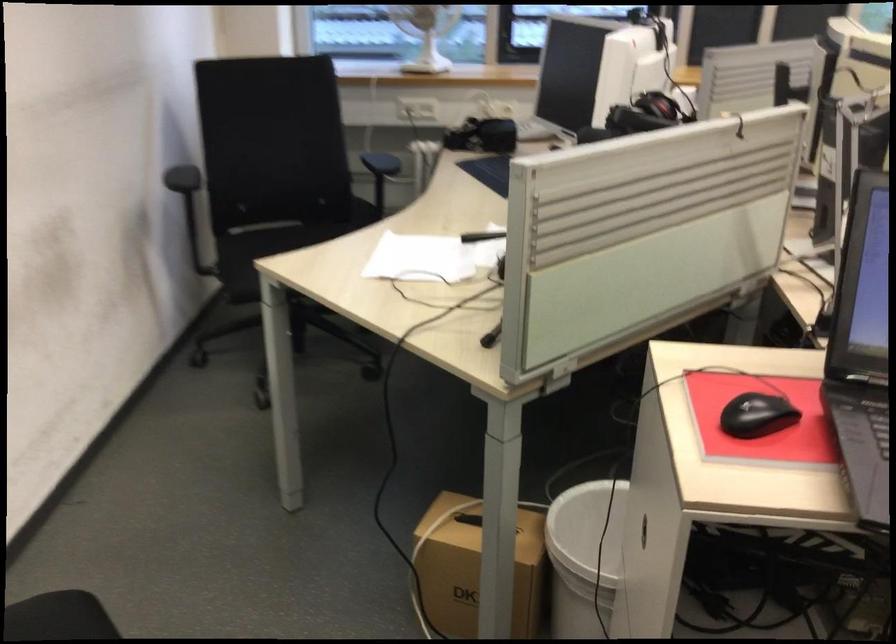
The image size is (896, 644). I want to click on black computer mouse, so click(x=756, y=415).